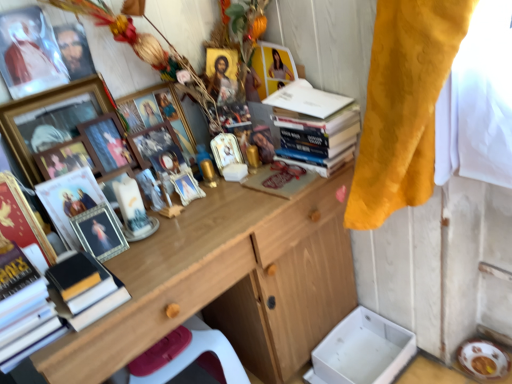
Identify the location of free space that is in between hardcover book at left, the 2th book in the top-to-bottom sequence, and matte brown book at center, arranged as the first magazine when viewed from the right. (201, 231).